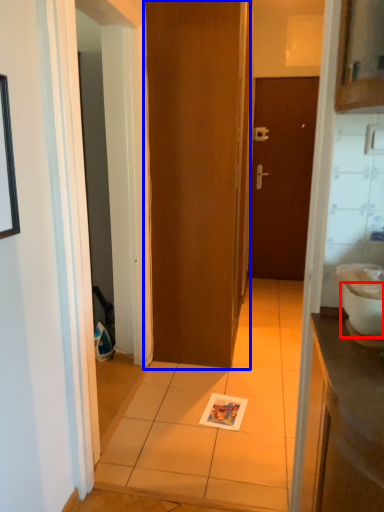
Question: Among these objects, which one is nearest to the camera, toilet bowl (highlighted by a red box) or door (highlighted by a blue box)?

Choices:
 (A) toilet bowl
 (B) door

Answer: (A)